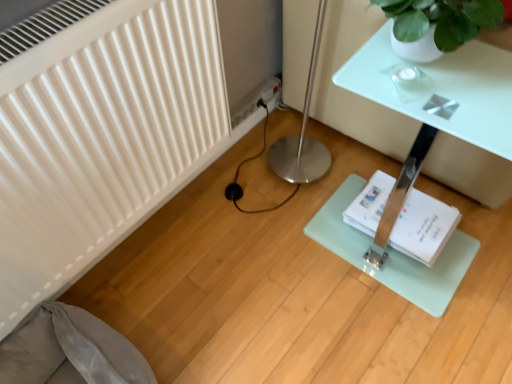
Question: Considering the positions of clear glass table at center and white paper book at center in the image, is clear glass table at center taller or shorter than white paper book at center?

Choices:
 (A) short
 (B) tall

Answer: (B)

Question: Visually, is clear glass table at center positioned to the left or to the right of white paper book at center?

Choices:
 (A) left
 (B) right

Answer: (B)

Question: Considering the real-world distances, which object is farthest from the clear glass table at center?

Choices:
 (A) white matte radiator at left
 (B) gray fabric swivel chair at lower left
 (C) white paper book at center

Answer: (B)

Question: Based on their relative distances, which object is farther from the white matte radiator at left?

Choices:
 (A) white paper book at center
 (B) gray fabric swivel chair at lower left
 (C) clear glass table at center

Answer: (A)